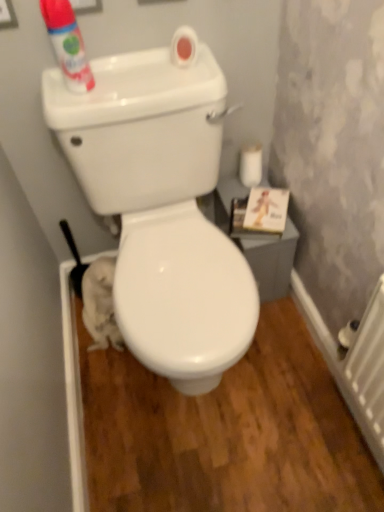
Locate an element on the screen. This screenshot has width=384, height=512. free location to the right of matte white can at upper left is located at coordinates (150, 86).